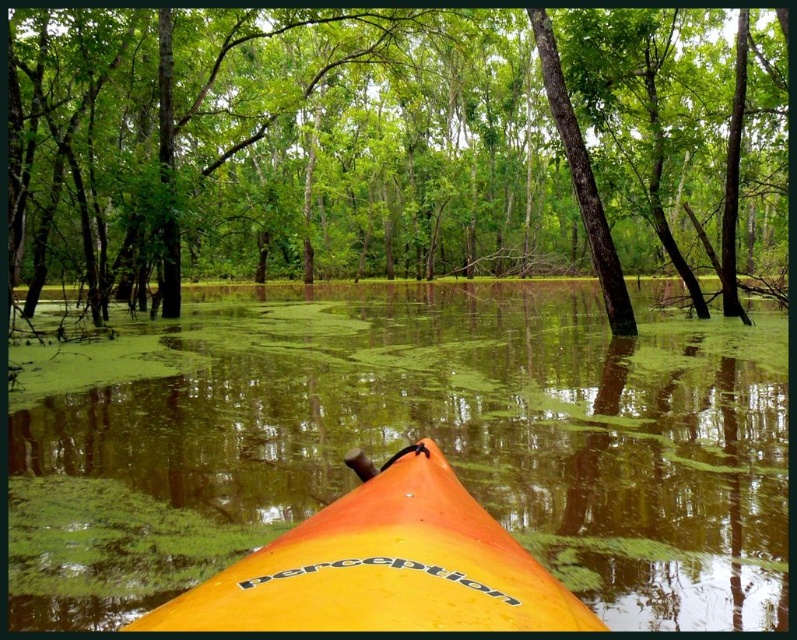
Question: Which point is closer to the camera?

Choices:
 (A) orange matte kayak at center
 (B) green leafy tree at center

Answer: (A)

Question: Which point is closer to the camera?

Choices:
 (A) (648, 451)
 (B) (623, 300)
 (C) (508, 541)
 (D) (646, 96)

Answer: (C)

Question: Can you confirm if green leafy tree at center is positioned to the left of green algae water at center?

Choices:
 (A) yes
 (B) no

Answer: (B)

Question: Can you confirm if green leafy tree at center is positioned to the right of orange matte kayak at center?

Choices:
 (A) yes
 (B) no

Answer: (A)

Question: Observing the image, what is the correct spatial positioning of green leafy tree at center in reference to orange matte kayak at center?

Choices:
 (A) above
 (B) below

Answer: (A)

Question: Which of the following is the closest to the observer?

Choices:
 (A) green leafy tree at center
 (B) orange matte kayak at center

Answer: (B)